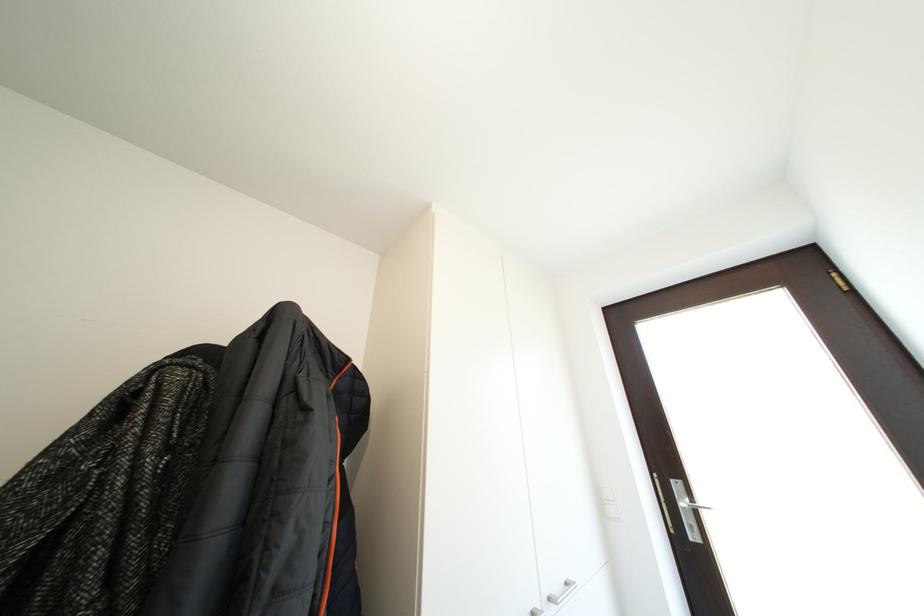
Image resolution: width=924 pixels, height=616 pixels. What do you see at coordinates (608, 496) in the screenshot? I see `a white light switch` at bounding box center [608, 496].